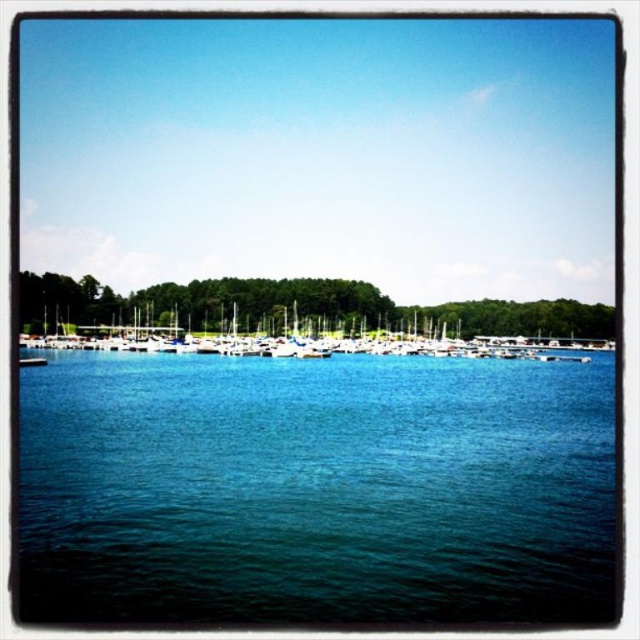
Question: Among these points, which one is farthest from the camera?

Choices:
 (A) (440, 336)
 (B) (65, 300)
 (C) (520, 428)

Answer: (A)

Question: Which point appears closest to the camera in this image?

Choices:
 (A) (58, 324)
 (B) (296, 616)
 (C) (547, 326)

Answer: (B)

Question: Is blue liquid water at center wider than green leafy trees at center?

Choices:
 (A) yes
 (B) no

Answer: (B)

Question: Which point is farther to the camera?

Choices:
 (A) (532, 301)
 (B) (497, 465)

Answer: (A)

Question: Is blue liquid water at center smaller than green leafy trees at center?

Choices:
 (A) yes
 (B) no

Answer: (A)

Question: Is the position of blue liquid water at center more distant than that of white matte boats at center?

Choices:
 (A) no
 (B) yes

Answer: (A)